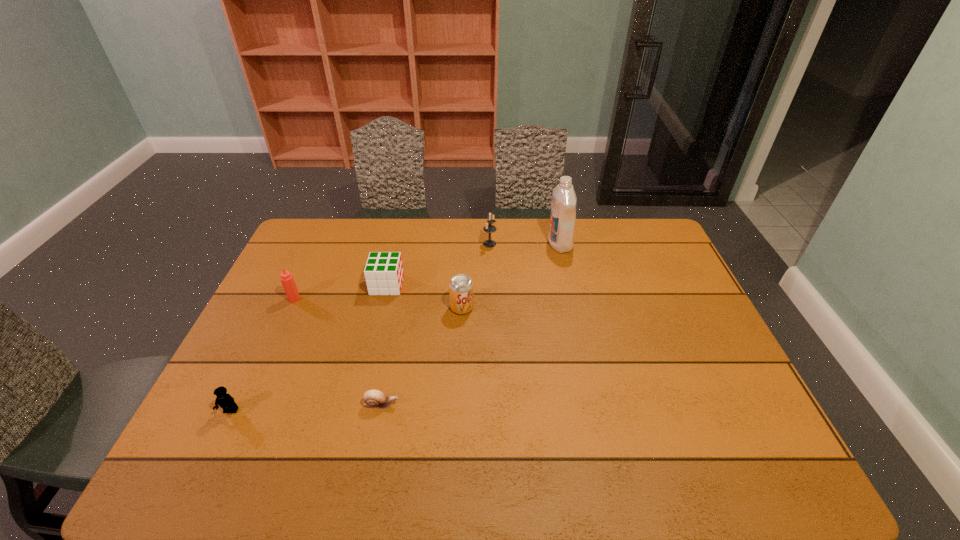
Where is `free space located 0.360m on the right of the Tabasco sauce`? free space located 0.360m on the right of the Tabasco sauce is located at coordinates (416, 299).

Find the location of a particular element. free space located 0.300m on the right of the third object from right to left is located at coordinates (572, 307).

This screenshot has height=540, width=960. Find the location of `vacant space located on the red face of the cube`. vacant space located on the red face of the cube is located at coordinates (480, 285).

Locate an element on the screen. This screenshot has width=960, height=540. vacant space situated 0.070m on the front-facing side of the Lego is located at coordinates (215, 444).

The height and width of the screenshot is (540, 960). Identify the location of vacant space located 0.330m on the front-facing side of the escargot. (533, 404).

Find the location of `detergent positioned at the far edge`. detergent positioned at the far edge is located at coordinates (564, 201).

This screenshot has height=540, width=960. What are the coordinates of `candle holder present at the far edge` in the screenshot? It's located at (489, 228).

I want to click on Tabasco sauce at the left edge, so click(x=287, y=280).

You are a GUI agent. You are given a task and a screenshot of the screen. Output one action in this format:
    pyautogui.click(x=<x>, y=<y>)
    Task: Click on the Lego situated at the left edge
    The width and height of the screenshot is (960, 540).
    Given the screenshot: What is the action you would take?
    pyautogui.click(x=225, y=401)

The width and height of the screenshot is (960, 540). Find the location of `vacant space at the far edge`. vacant space at the far edge is located at coordinates (510, 235).